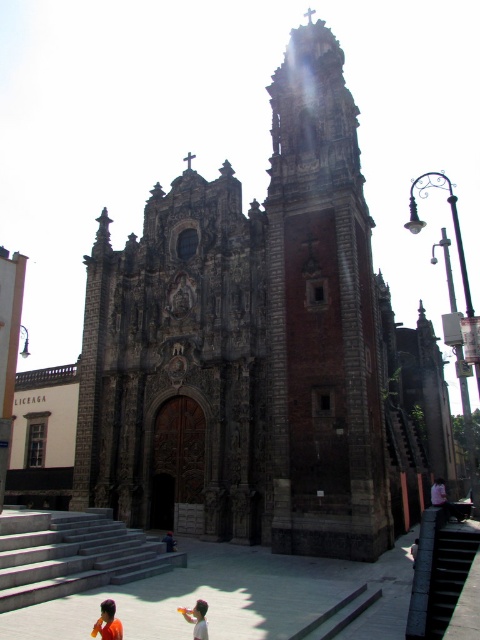
Question: Can you confirm if gray concrete stairs at lower left is smaller than light blue shirt at lower right?

Choices:
 (A) yes
 (B) no

Answer: (B)

Question: Is gray concrete stairs at lower left positioned behind orange fabric person at lower center?

Choices:
 (A) no
 (B) yes

Answer: (A)

Question: Which object appears closest to the camera in this image?

Choices:
 (A) light yellow fabric at lower center
 (B) brick tower at center
 (C) orange fabric at lower center
 (D) gray concrete stairs at lower left

Answer: (A)

Question: Which object is closer to the camera taking this photo?

Choices:
 (A) orange fabric at lower center
 (B) light blue shirt at lower right

Answer: (A)

Question: Among these points, which one is nearest to the camera?

Choices:
 (A) (194, 604)
 (B) (362, 291)

Answer: (A)

Question: Considering the relative positions of light yellow fabric at lower center and light blue shirt at lower right in the image provided, where is light yellow fabric at lower center located with respect to light blue shirt at lower right?

Choices:
 (A) above
 (B) below

Answer: (B)